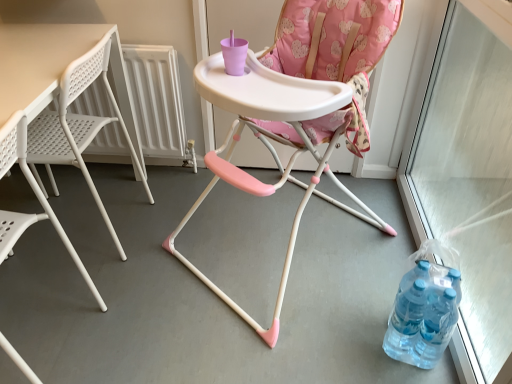
Identify the location of vacant space in between white plastic radiator at left and translucent plastic bottles at lower right. This screenshot has width=512, height=384. (248, 243).